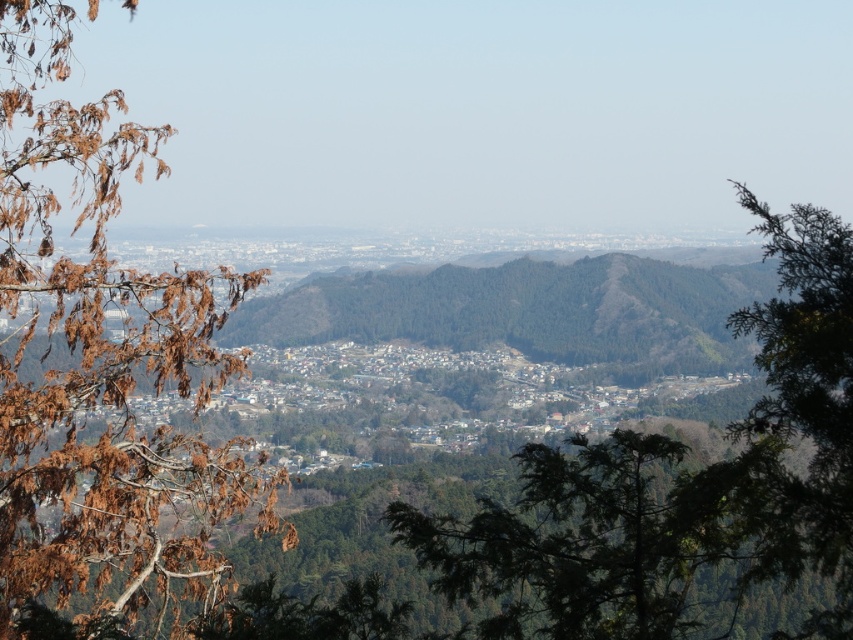
Question: Among these objects, which one is nearest to the camera?

Choices:
 (A) brown dried leaves at left
 (B) green leafy tree at center
 (C) green leafy tree at right

Answer: (B)

Question: Does brown dried leaves at left have a larger size compared to green leafy tree at center?

Choices:
 (A) yes
 (B) no

Answer: (A)

Question: Can you confirm if brown dried leaves at left is positioned above green leafy tree at right?

Choices:
 (A) yes
 (B) no

Answer: (A)

Question: Which point is farther to the camera?

Choices:
 (A) (827, 436)
 (B) (654, 556)
 (C) (50, 145)

Answer: (C)

Question: Does green leafy tree at center appear on the right side of green leafy tree at right?

Choices:
 (A) yes
 (B) no

Answer: (B)

Question: Which of the following is the farthest from the observer?

Choices:
 (A) green leafy tree at center
 (B) brown dried leaves at left

Answer: (B)